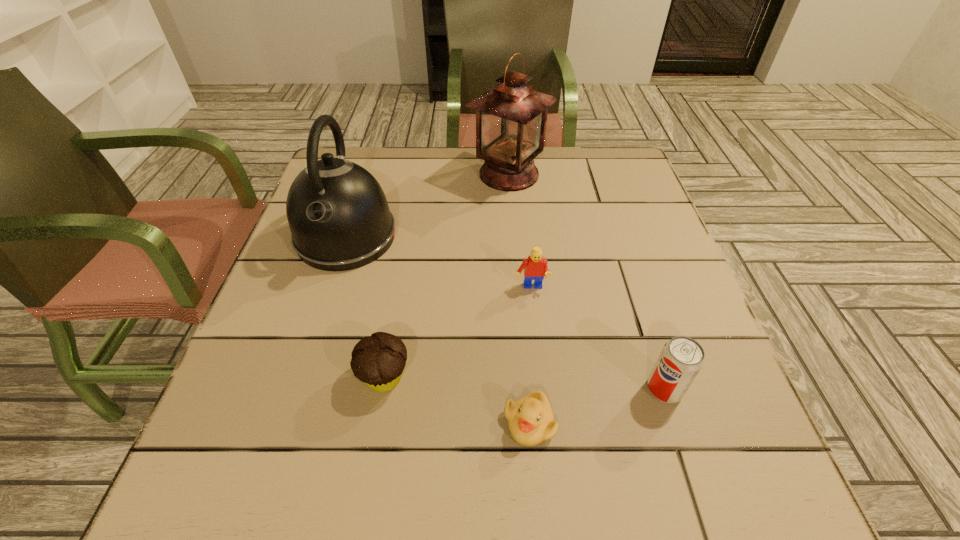
Where is `blank space at the far right corner`? blank space at the far right corner is located at coordinates (630, 168).

This screenshot has width=960, height=540. What are the coordinates of `vacant space at the near right corner` in the screenshot? It's located at (775, 489).

The image size is (960, 540). Find the location of `free space between the soda and the shortest object`. free space between the soda and the shortest object is located at coordinates (597, 406).

This screenshot has height=540, width=960. I want to click on free space between the farthest object and the Lego, so click(519, 231).

Identify the location of free space between the duckling and the soda. The height and width of the screenshot is (540, 960). (597, 406).

Where is `blank region between the fifth nearest object and the Lego`? blank region between the fifth nearest object and the Lego is located at coordinates (439, 262).

Locate an element on the screen. vacant space in between the oil lamp and the Lego is located at coordinates (519, 231).

Find the location of a particular element. The image size is (960, 540). vacant area between the muffin and the shortest object is located at coordinates (457, 400).

In order to click on vacant area that lies between the soda and the second shortest object in this screenshot , I will do `click(524, 383)`.

The image size is (960, 540). What are the coordinates of `free space between the third farthest object and the oil lamp` in the screenshot? It's located at (519, 231).